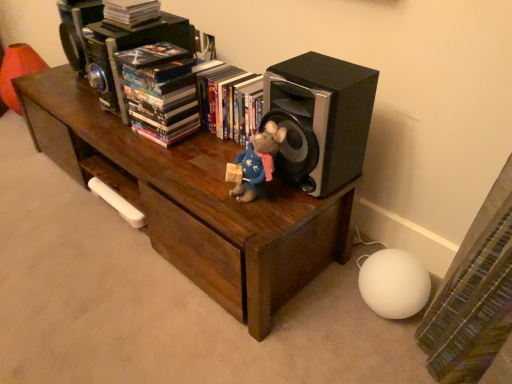
Question: From a real-world perspective, is hardcover book at center, the third book from the left, physically located above or below brown wood table at center?

Choices:
 (A) below
 (B) above

Answer: (B)

Question: Considering the positions of hardcover book at center, arranged as the first book when viewed from the right, and brown wood table at center in the image, is hardcover book at center, arranged as the first book when viewed from the right, wider or thinner than brown wood table at center?

Choices:
 (A) thin
 (B) wide

Answer: (A)

Question: Which object is the closest to the multicolored paperbacks at upper center, the 2th book when ordered from left to right?

Choices:
 (A) velvety blue plush at center
 (B) hardcover book at center, arranged as the first book when viewed from the right
 (C) matte black book at upper center, the 3th book in the right-to-left sequence
 (D) black matte speaker at right
 (E) brown wood table at center

Answer: (B)

Question: Considering the real-world distances, which object is closest to the black matte speaker at right?

Choices:
 (A) brown wood table at center
 (B) matte black book at upper center, the first book positioned from the left
 (C) hardcover book at center, arranged as the first book when viewed from the right
 (D) velvety blue plush at center
 (E) multicolored paperbacks at upper center, the 2th book when ordered from left to right

Answer: (D)